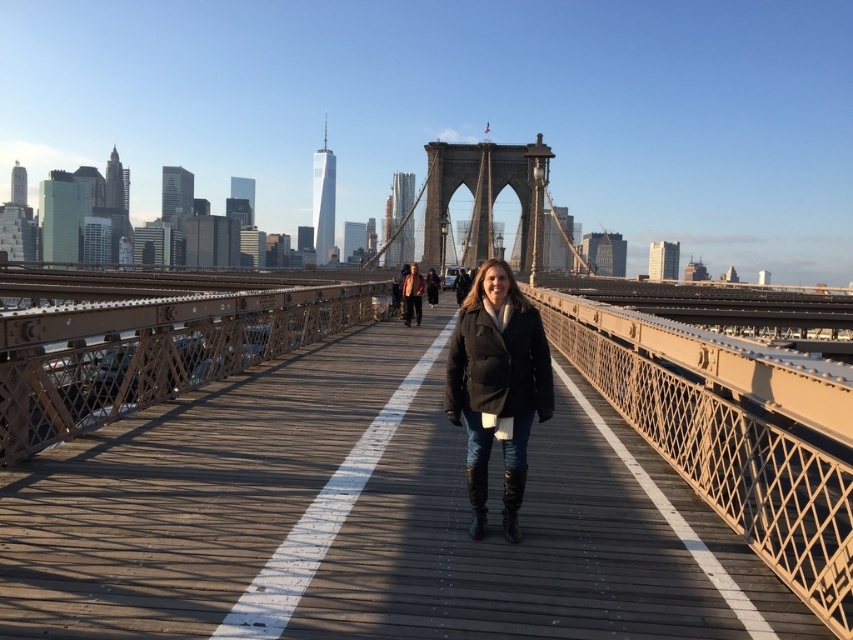
Question: Does brown metal bridge at center have a larger size compared to matte brown jacket at center?

Choices:
 (A) yes
 (B) no

Answer: (A)

Question: Is brown metal bridge at center bigger than matte brown jacket at center?

Choices:
 (A) no
 (B) yes

Answer: (B)

Question: Which is nearer to the black leather jacket at center?

Choices:
 (A) dark brown leather jacket at center
 (B) leather at center
 (C) brown metal bridge at center

Answer: (B)

Question: Does matte brown jacket at center appear on the left side of dark brown leather jacket at center?

Choices:
 (A) no
 (B) yes

Answer: (B)

Question: Which object is the closest to the dark brown leather jacket at center?

Choices:
 (A) leather at center
 (B) brown metal bridge at center

Answer: (B)

Question: Which of these objects is positioned farthest from the black leather jacket at center?

Choices:
 (A) dark brown leather jacket at center
 (B) matte brown jacket at center
 (C) leather boots at center

Answer: (A)